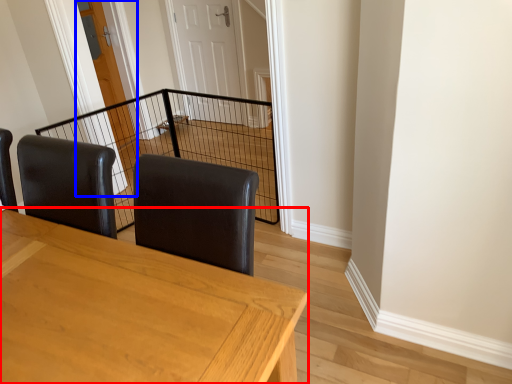
Question: Which of the following is the farthest to the observer, table (highlighted by a red box) or door (highlighted by a blue box)?

Choices:
 (A) table
 (B) door

Answer: (B)